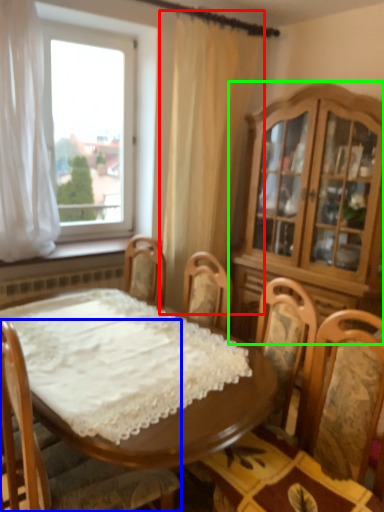
Question: Which object is positioned closest to curtain (highlighted by a red box)? Select from chair (highlighted by a blue box) and cabinetry (highlighted by a green box).

Choices:
 (A) chair
 (B) cabinetry

Answer: (B)